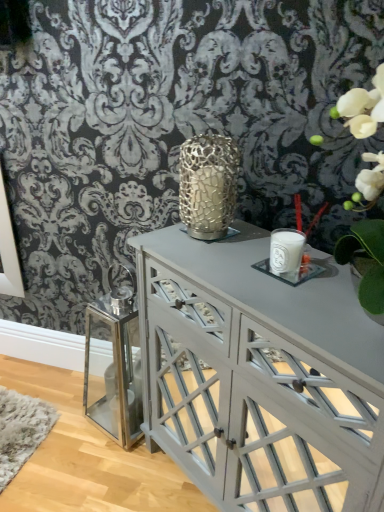
Question: Should I look upward or downward to see white glass candle at center, the 1th candle holder ordered from the bottom?

Choices:
 (A) up
 (B) down

Answer: (A)

Question: From a real-world perspective, is matte gray cabinet at center physically above gold textured candle holder at center, marked as the 1th candle holder in a top-to-bottom arrangement?

Choices:
 (A) yes
 (B) no

Answer: (B)

Question: Can you confirm if matte gray cabinet at center is wider than gold textured candle holder at center, marked as the 1th candle holder in a top-to-bottom arrangement?

Choices:
 (A) no
 (B) yes

Answer: (B)

Question: Is gold textured candle holder at center, which is counted as the second candle holder, starting from the right, surrounded by matte gray cabinet at center?

Choices:
 (A) yes
 (B) no

Answer: (B)

Question: Is matte gray cabinet at center outside gold textured candle holder at center, acting as the first candle holder starting from the left?

Choices:
 (A) no
 (B) yes

Answer: (B)

Question: Can you see matte gray cabinet at center touching gold textured candle holder at center, arranged as the 2th candle holder when ordered from the bottom?

Choices:
 (A) yes
 (B) no

Answer: (B)

Question: Is matte gray cabinet at center taller than gold textured candle holder at center, marked as the 1th candle holder in a top-to-bottom arrangement?

Choices:
 (A) no
 (B) yes

Answer: (B)

Question: Does gold textured candle holder at center, acting as the first candle holder starting from the left, appear on the left side of white glass candle at center, marked as the 1th candle holder in a right-to-left arrangement?

Choices:
 (A) yes
 (B) no

Answer: (A)

Question: Can you confirm if gold textured candle holder at center, marked as the 1th candle holder in a top-to-bottom arrangement, is wider than white glass candle at center, the 1th candle holder ordered from the bottom?

Choices:
 (A) yes
 (B) no

Answer: (A)

Question: Does gold textured candle holder at center, which is counted as the second candle holder, starting from the right, come in front of white glass candle at center, the second candle holder positioned from the left?

Choices:
 (A) yes
 (B) no

Answer: (B)

Question: From the image's perspective, is gold textured candle holder at center, acting as the first candle holder starting from the left, above white glass candle at center, the second candle holder positioned from the left?

Choices:
 (A) yes
 (B) no

Answer: (A)

Question: Is gold textured candle holder at center, arranged as the 2th candle holder when ordered from the bottom, beside white glass candle at center, the 1th candle holder ordered from the bottom?

Choices:
 (A) yes
 (B) no

Answer: (B)

Question: Is gold textured candle holder at center, marked as the 1th candle holder in a top-to-bottom arrangement, bigger than white glass candle at center, marked as the 1th candle holder in a right-to-left arrangement?

Choices:
 (A) yes
 (B) no

Answer: (A)

Question: Is matte gray cabinet at center positioned with its back to white glass candle at center, marked as the 1th candle holder in a right-to-left arrangement?

Choices:
 (A) no
 (B) yes

Answer: (A)